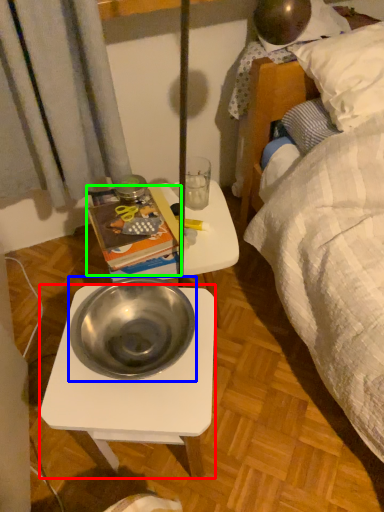
Question: Which is nearer to the desk (highlighted by a red box)? bowl (highlighted by a blue box) or paperback book (highlighted by a green box).

Choices:
 (A) bowl
 (B) paperback book

Answer: (A)